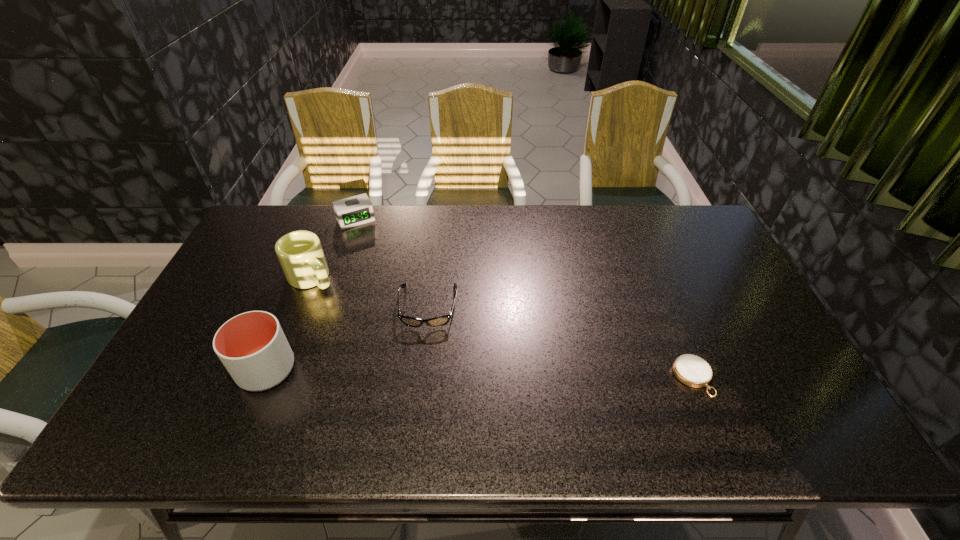
At what (x,y) coordinates should I click in order to perform the action: click on vacant space on the desktop that is between the cup and the compass and is positioned on the front-facing side of the fourth object from left to right. Please return your answer as a coordinate pair (x, y). Looking at the image, I should click on (421, 373).

Where is `free space on the desktop that is between the cup and the compass and is positioned on the front-facing side of the alarm clock`? This screenshot has width=960, height=540. free space on the desktop that is between the cup and the compass and is positioned on the front-facing side of the alarm clock is located at coordinates (436, 373).

Locate an element on the screen. Image resolution: width=960 pixels, height=540 pixels. free space on the desktop that is between the cup and the compass and is positioned with the handle on the side of the mug is located at coordinates (417, 372).